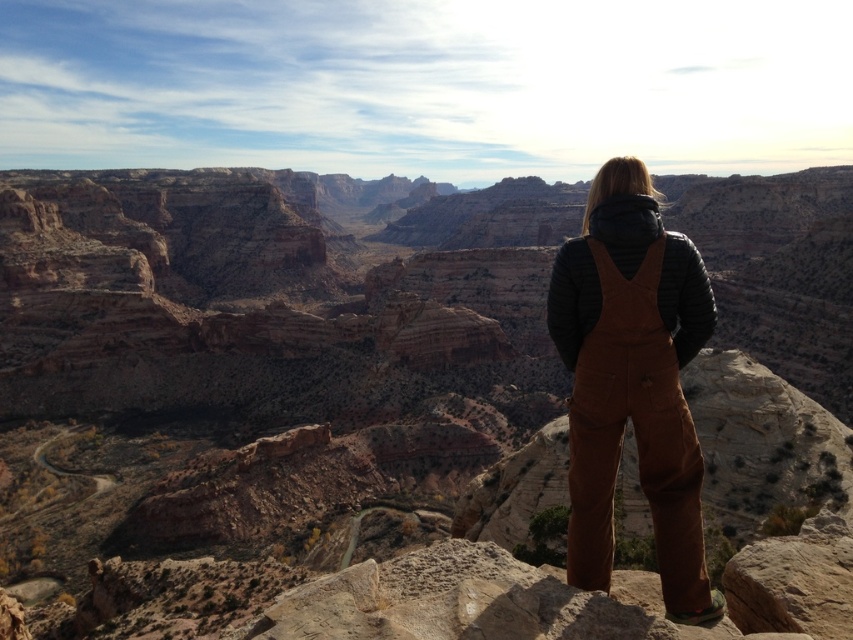
Question: Can you confirm if brown rock canyon at center is positioned below brown cotton overalls at center?

Choices:
 (A) yes
 (B) no

Answer: (B)

Question: Considering the relative positions of brown rock canyon at center and brown cotton overalls at center in the image provided, where is brown rock canyon at center located with respect to brown cotton overalls at center?

Choices:
 (A) above
 (B) below

Answer: (A)

Question: Is brown rock canyon at center to the right of brown cotton overalls at center from the viewer's perspective?

Choices:
 (A) no
 (B) yes

Answer: (A)

Question: Which object is closer to the camera taking this photo?

Choices:
 (A) brown rock canyon at center
 (B) brown cotton overalls at center

Answer: (A)